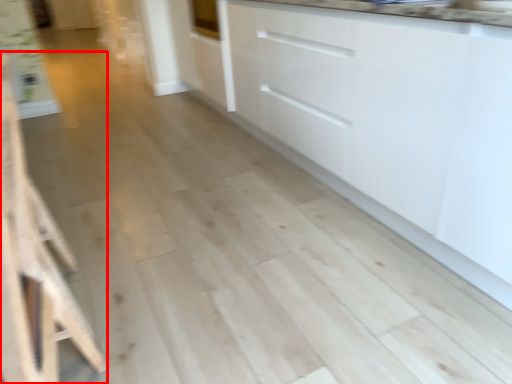
Question: From the image's perspective, what is the correct spatial relationship of furniture (annotated by the red box) in relation to cabinetry?

Choices:
 (A) above
 (B) below

Answer: (B)